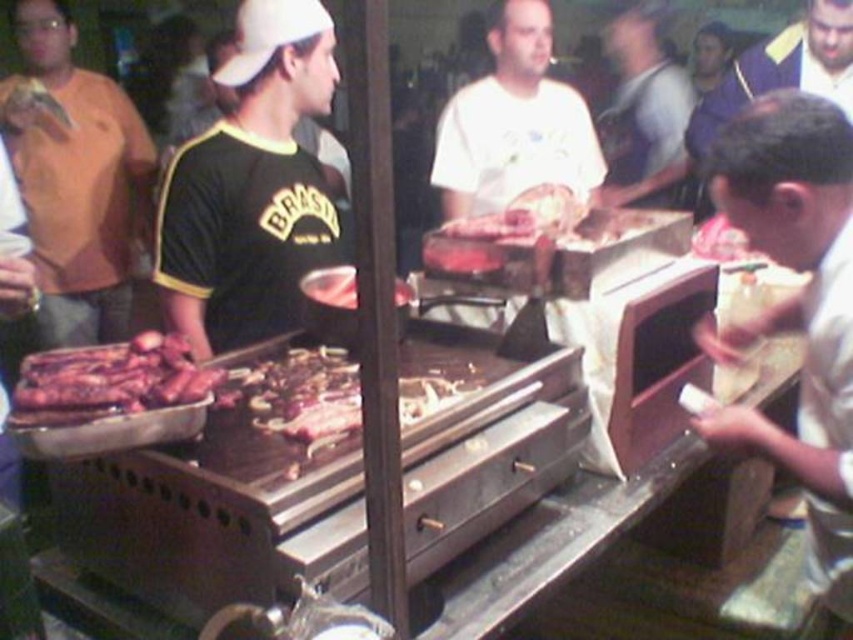
Question: Is white matte shirt at center bigger than gray fabric shirt at upper center?

Choices:
 (A) no
 (B) yes

Answer: (A)

Question: Is white matte shirt at center bigger than shiny brown ribs at left?

Choices:
 (A) yes
 (B) no

Answer: (A)

Question: Does black matte jersey at center appear on the left side of shiny brown ribs at left?

Choices:
 (A) no
 (B) yes

Answer: (A)

Question: Which of the following is the farthest from the observer?

Choices:
 (A) (260, 148)
 (B) (50, 339)

Answer: (B)

Question: Estimate the real-world distances between objects in this image. Which object is farther from the black matte jersey at center?

Choices:
 (A) matte orange shirt at left
 (B) white matte shirt at center
 (C) shiny brown ribs at left
 (D) white shirt at right

Answer: (A)

Question: Which of these objects is positioned farthest from the gray fabric shirt at upper center?

Choices:
 (A) white shirt at right
 (B) matte orange shirt at left
 (C) black matte jersey at center
 (D) white matte shirt at center

Answer: (A)